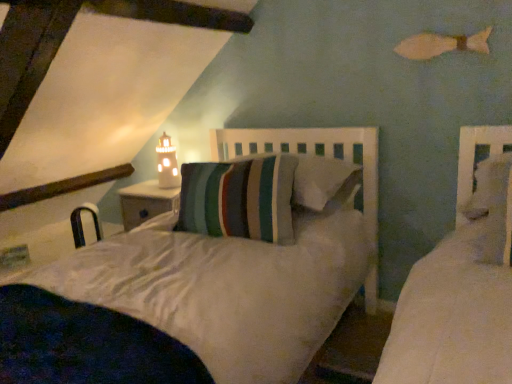
Describe the element at coordinates (82, 225) in the screenshot. I see `metallic silver chair at lower left` at that location.

This screenshot has height=384, width=512. I want to click on metallic silver chair at lower left, so click(x=82, y=225).

Identify the location of white ceramic lighthouse at upper center. The width and height of the screenshot is (512, 384). (167, 163).

Which is behind, point (76, 248) or point (173, 157)?

The point (76, 248) is behind.

Can you confirm if metallic silver chair at lower left is positioned to the left of white ceramic lighthouse at upper center?

Correct, you'll find metallic silver chair at lower left to the left of white ceramic lighthouse at upper center.

Who is smaller, metallic silver chair at lower left or white ceramic lighthouse at upper center?

white ceramic lighthouse at upper center.

Which of these two, striped fabric pillow at center or white ceramic lighthouse at upper center, is wider?

Wider between the two is striped fabric pillow at center.

Is striped fabric pillow at center positioned beyond the bounds of white ceramic lighthouse at upper center?

That's correct, striped fabric pillow at center is outside of white ceramic lighthouse at upper center.

Which object is positioned more to the right, striped fabric pillow at center or white ceramic lighthouse at upper center?

Positioned to the right is striped fabric pillow at center.

Based on the photo, is white ceramic lighthouse at upper center not within striped fabric pillow at center?

white ceramic lighthouse at upper center is positioned outside striped fabric pillow at center.

This screenshot has width=512, height=384. What are the coordinates of `pillow lying on the right of white ceramic lighthouse at upper center` in the screenshot? It's located at (319, 180).

Consider the image. Between white ceramic lighthouse at upper center and striped fabric pillow at center, which one appears on the left side from the viewer's perspective?

white ceramic lighthouse at upper center.

Does point (95, 223) appear closer or farther from the camera than point (315, 174)?

Point (95, 223) appears to be farther away from the viewer than point (315, 174).

From the image's perspective, is metallic silver chair at lower left positioned above or below striped fabric pillow at center?

Clearly, from the image's perspective, metallic silver chair at lower left is below striped fabric pillow at center.

Who is bigger, metallic silver chair at lower left or striped fabric pillow at center?

With larger size is striped fabric pillow at center.

Which object is thinner, metallic silver chair at lower left or striped fabric pillow at center?

metallic silver chair at lower left.

Measure the distance from white ceramic lighthouse at upper center to metallic silver chair at lower left.

white ceramic lighthouse at upper center is 23.85 inches from metallic silver chair at lower left.

Is white ceramic lighthouse at upper center placed right next to metallic silver chair at lower left?

white ceramic lighthouse at upper center and metallic silver chair at lower left are clearly separated.

Is white ceramic lighthouse at upper center looking in the opposite direction of metallic silver chair at lower left?

No, metallic silver chair at lower left is not at the back of white ceramic lighthouse at upper center.

From the image's perspective, which is below, white ceramic lighthouse at upper center or metallic silver chair at lower left?

metallic silver chair at lower left appears lower in the image.

Is striped fabric pillow at center completely or partially outside of metallic silver chair at lower left?

Yes, striped fabric pillow at center is not within metallic silver chair at lower left.

Are striped fabric pillow at center and metallic silver chair at lower left beside each other?

No, striped fabric pillow at center is not in contact with metallic silver chair at lower left.

Considering the relative positions of striped fabric pillow at center and metallic silver chair at lower left in the image provided, is striped fabric pillow at center to the right of metallic silver chair at lower left from the viewer's perspective?

Correct, you'll find striped fabric pillow at center to the right of metallic silver chair at lower left.

Where is `table lamp on the right side of metallic silver chair at lower left`? table lamp on the right side of metallic silver chair at lower left is located at coordinates (167, 163).

The image size is (512, 384). I want to click on table lamp located behind the striped fabric pillow at center, so click(x=167, y=163).

Based on their spatial positions, is metallic silver chair at lower left or striped fabric pillow at center closer to white ceramic lighthouse at upper center?

metallic silver chair at lower left.

Which object lies nearer to the anchor point white ceramic lighthouse at upper center, striped fabric pillow at center or metallic silver chair at lower left?

metallic silver chair at lower left.

Which object lies further to the anchor point metallic silver chair at lower left, white ceramic lighthouse at upper center or striped fabric pillow at center?

striped fabric pillow at center is further to metallic silver chair at lower left.

Based on the photo, considering their positions, is metallic silver chair at lower left positioned further to striped fabric pillow at center than white ceramic lighthouse at upper center?

metallic silver chair at lower left is further to striped fabric pillow at center.

When comparing their distances from metallic silver chair at lower left, does striped fabric pillow at center or white ceramic lighthouse at upper center seem further?

The object further to metallic silver chair at lower left is striped fabric pillow at center.

Looking at the image, which one is located closer to striped fabric pillow at center, white ceramic lighthouse at upper center or metallic silver chair at lower left?

white ceramic lighthouse at upper center is closer to striped fabric pillow at center.

Identify the location of table lamp between metallic silver chair at lower left and striped fabric pillow at center from left to right. This screenshot has width=512, height=384. (167, 163).